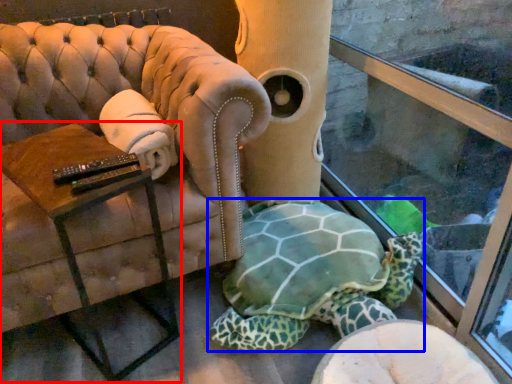
Question: Which object appears farthest to the camera in this image, table (highlighted by a red box) or tortoise (highlighted by a blue box)?

Choices:
 (A) table
 (B) tortoise

Answer: (B)